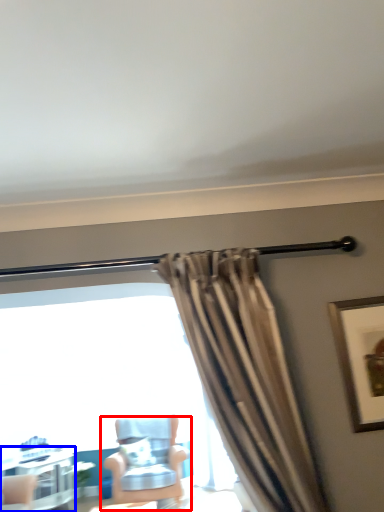
Question: Which point is closer to the camera, chair (highlighted by a red box) or table (highlighted by a blue box)?

Choices:
 (A) chair
 (B) table

Answer: (A)